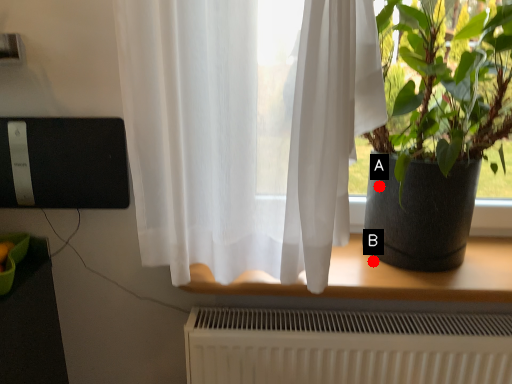
Question: Two points are circled on the image, labeled by A and B beside each circle. Which point appears closest to the camera in this image?

Choices:
 (A) A is closer
 (B) B is closer

Answer: (A)